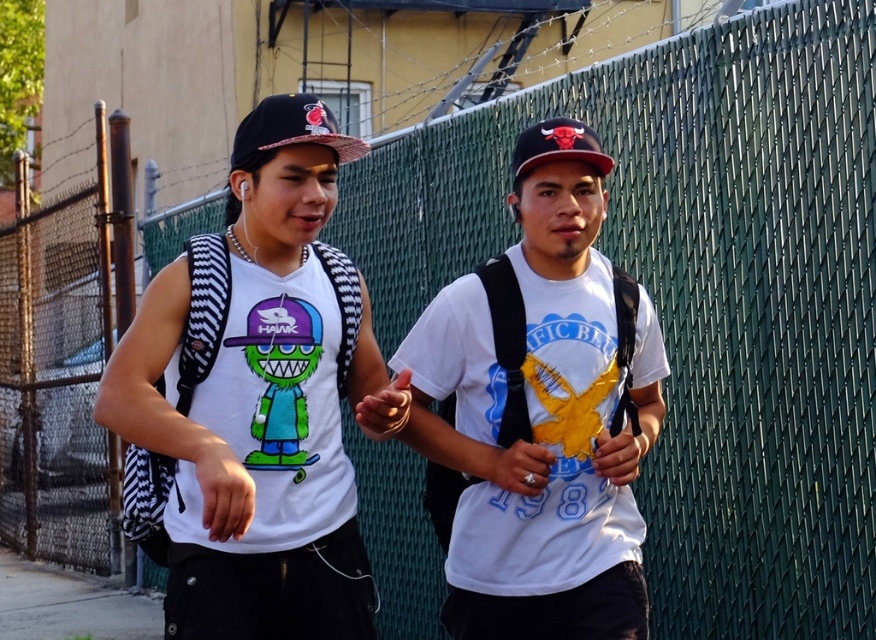
Locate an element on the screen. This screenshot has width=876, height=640. matte black baseball cap at upper center is located at coordinates (292, 129).

Can you confirm if matte black baseball cap at upper center is taller than silver metallic ring at center?

In fact, matte black baseball cap at upper center may be shorter than silver metallic ring at center.

Between point (328, 113) and point (513, 483), which one is positioned in front?

Positioned in front is point (328, 113).

Locate an element on the screen. matte black baseball cap at upper center is located at coordinates [292, 129].

Which of these two, matte black baseball cap at upper center or red matte baseball cap at center, stands taller?

red matte baseball cap at center is taller.

Can you confirm if matte black baseball cap at upper center is thinner than red matte baseball cap at center?

Indeed, matte black baseball cap at upper center has a lesser width compared to red matte baseball cap at center.

Where is `matte black baseball cap at upper center`? matte black baseball cap at upper center is located at coordinates (292, 129).

Does matte white t-shirt at center appear on the left side of silver metallic ring at center?

Yes, matte white t-shirt at center is to the left of silver metallic ring at center.

Does matte white t-shirt at center have a greater height compared to silver metallic ring at center?

Correct, matte white t-shirt at center is much taller as silver metallic ring at center.

Which is behind, point (274, 138) or point (544, 474)?

Positioned behind is point (544, 474).

The image size is (876, 640). I want to click on matte white t-shirt at center, so click(x=260, y=397).